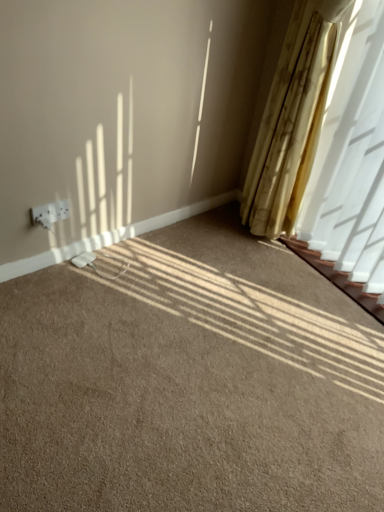
What do you see at coordinates (190, 381) in the screenshot? I see `brown carpet at center` at bounding box center [190, 381].

This screenshot has height=512, width=384. In order to click on brown carpet at center in this screenshot , I will do `click(190, 381)`.

Is yellow textured curtain at right looking in the opposite direction of white plastic outlet at lower left?

No, yellow textured curtain at right is not facing away from white plastic outlet at lower left.

Find the location of a particular element. curtain on the right of white plastic outlet at lower left is located at coordinates (344, 117).

Is yellow textured curtain at right far from white plastic outlet at lower left?

yellow textured curtain at right is far away from white plastic outlet at lower left.

Can you confirm if yellow textured curtain at right is wider than brown carpet at center?

Incorrect, the width of yellow textured curtain at right does not surpass that of brown carpet at center.

Which of these two, yellow textured curtain at right or brown carpet at center, is bigger?

brown carpet at center is bigger.

Could you tell me if yellow textured curtain at right is facing brown carpet at center?

Yes.

From the image's perspective, would you say yellow textured curtain at right is positioned over brown carpet at center?

Yes, from the image's perspective, yellow textured curtain at right is over brown carpet at center.

Locate an element on the screen. electric outlet beneath the yellow textured curtain at right (from a real-world perspective) is located at coordinates (50, 213).

Is point (53, 203) closer or farther from the camera than point (346, 165)?

Point (53, 203) appears to be closer to the viewer than point (346, 165).

Is white plastic outlet at lower left wider than yellow textured curtain at right?

No, white plastic outlet at lower left is not wider than yellow textured curtain at right.

From a real-world perspective, is white plastic outlet at lower left physically below yellow textured curtain at right?

Yes.

Between brown carpet at center and yellow textured curtain at right, which one appears on the left side from the viewer's perspective?

brown carpet at center is more to the left.

Considering the positions of points (306, 440) and (346, 87), is point (306, 440) closer to camera compared to point (346, 87)?

Yes, point (306, 440) is in front of point (346, 87).

Considering the positions of objects brown carpet at center and yellow textured curtain at right in the image provided, who is in front, brown carpet at center or yellow textured curtain at right?

Positioned in front is brown carpet at center.

Could you tell me if brown carpet at center is turned towards yellow textured curtain at right?

No, brown carpet at center is not aimed at yellow textured curtain at right.

Considering their positions, is brown carpet at center located in front of or behind white plastic outlet at lower left?

Clearly, brown carpet at center is in front of white plastic outlet at lower left.

Is white plastic outlet at lower left at the back of brown carpet at center?

No.

Who is taller, brown carpet at center or white plastic outlet at lower left?

Standing taller between the two is white plastic outlet at lower left.

Is white plastic outlet at lower left turned away from brown carpet at center?

No, white plastic outlet at lower left's orientation is not away from brown carpet at center.

From the picture: From a real-world perspective, is white plastic outlet at lower left located beneath brown carpet at center?

No, from a real-world perspective, white plastic outlet at lower left is not below brown carpet at center.

Find the location of a particular element. plain that is in front of the white plastic outlet at lower left is located at coordinates pyautogui.click(x=190, y=381).

The width and height of the screenshot is (384, 512). Identify the location of electric outlet that is on the left side of yellow textured curtain at right. (50, 213).

What are the coordinates of `plain in front of the yellow textured curtain at right` in the screenshot? It's located at (190, 381).

In the scene shown: Estimate the real-world distances between objects in this image. Which object is closer to brown carpet at center, white plastic outlet at lower left or yellow textured curtain at right?

The object closer to brown carpet at center is white plastic outlet at lower left.

Estimate the real-world distances between objects in this image. Which object is further from white plastic outlet at lower left, yellow textured curtain at right or brown carpet at center?

Among the two, yellow textured curtain at right is located further to white plastic outlet at lower left.

Considering their positions, is brown carpet at center positioned closer to yellow textured curtain at right than white plastic outlet at lower left?

brown carpet at center.

From the image, which object appears to be nearer to yellow textured curtain at right, white plastic outlet at lower left or brown carpet at center?

Among the two, brown carpet at center is located nearer to yellow textured curtain at right.

When comparing their distances from white plastic outlet at lower left, does brown carpet at center or yellow textured curtain at right seem closer?

The object closer to white plastic outlet at lower left is brown carpet at center.

When comparing their distances from brown carpet at center, does yellow textured curtain at right or white plastic outlet at lower left seem further?

yellow textured curtain at right lies further to brown carpet at center than the other object.

Where is `plain between white plastic outlet at lower left and yellow textured curtain at right from left to right`? Image resolution: width=384 pixels, height=512 pixels. plain between white plastic outlet at lower left and yellow textured curtain at right from left to right is located at coordinates (190, 381).